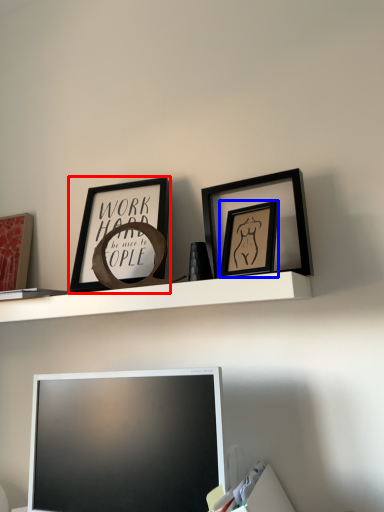
Question: Which of the following is the farthest to the observer, picture frame (highlighted by a red box) or picture frame (highlighted by a blue box)?

Choices:
 (A) picture frame
 (B) picture frame

Answer: (A)